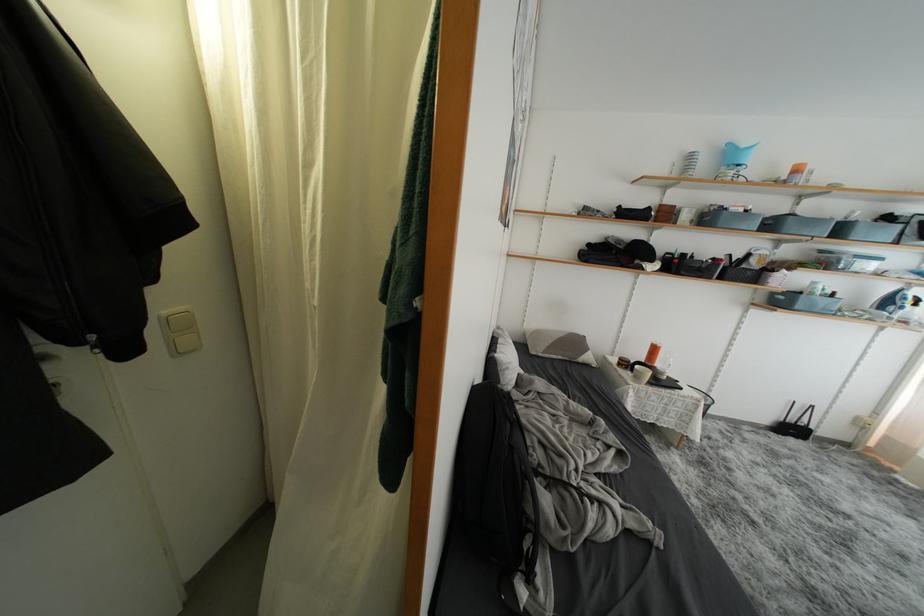
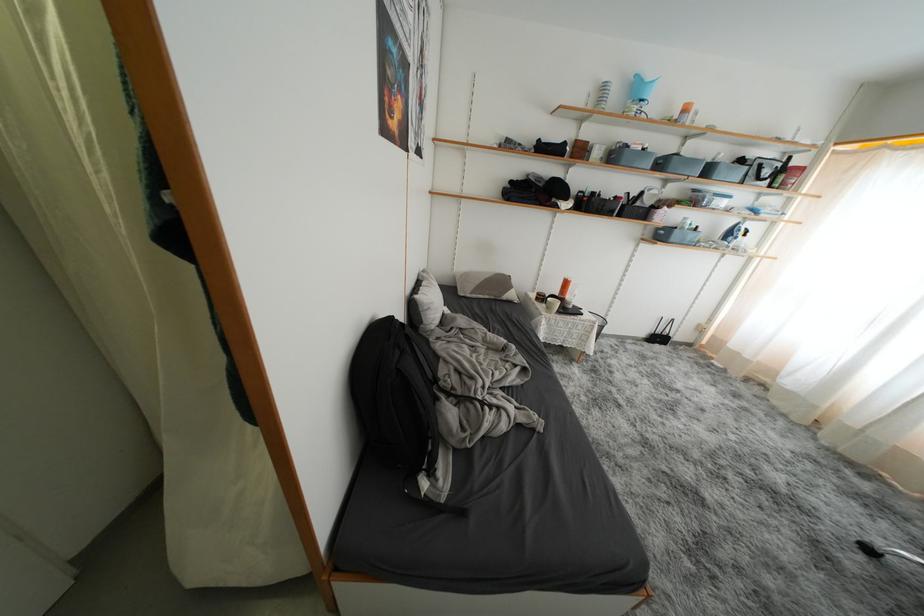
Question: What movement of the cameraman would produce the second image?

Choices:
 (A) Left
 (B) Right
 (C) Forward
 (D) Backward

Answer: (B)